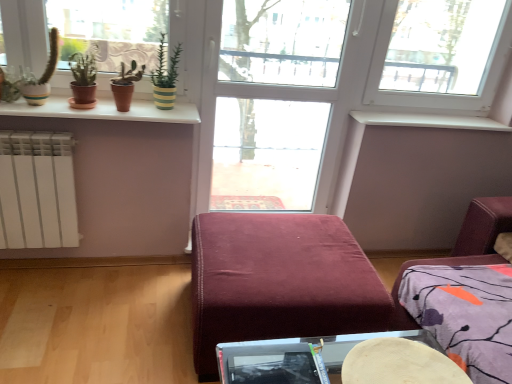
Question: Can you confirm if wooden round table at lower center is bigger than transparent glass door at center?

Choices:
 (A) no
 (B) yes

Answer: (A)

Question: Considering the relative sizes of wooden round table at lower center and transparent glass door at center in the image provided, is wooden round table at lower center thinner than transparent glass door at center?

Choices:
 (A) no
 (B) yes

Answer: (A)

Question: Is wooden round table at lower center positioned far away from transparent glass door at center?

Choices:
 (A) no
 (B) yes

Answer: (B)

Question: Would you say wooden round table at lower center is outside transparent glass door at center?

Choices:
 (A) yes
 (B) no

Answer: (A)

Question: Does wooden round table at lower center have a greater width compared to transparent glass door at center?

Choices:
 (A) no
 (B) yes

Answer: (B)

Question: Considering the relative sizes of wooden round table at lower center and transparent glass door at center in the image provided, is wooden round table at lower center smaller than transparent glass door at center?

Choices:
 (A) no
 (B) yes

Answer: (B)

Question: Is transparent glass door at center outside of wooden round table at lower center?

Choices:
 (A) no
 (B) yes

Answer: (B)

Question: Is transparent glass door at center oriented towards wooden round table at lower center?

Choices:
 (A) no
 (B) yes

Answer: (B)

Question: Is transparent glass door at center directly adjacent to wooden round table at lower center?

Choices:
 (A) no
 (B) yes

Answer: (A)

Question: Is transparent glass door at center oriented away from wooden round table at lower center?

Choices:
 (A) yes
 (B) no

Answer: (B)

Question: From the image's perspective, is transparent glass door at center below wooden round table at lower center?

Choices:
 (A) yes
 (B) no

Answer: (B)

Question: From the image's perspective, does transparent glass door at center appear higher than wooden round table at lower center?

Choices:
 (A) yes
 (B) no

Answer: (A)

Question: Is transparent glass door at center not near green striped pot at upper center?

Choices:
 (A) yes
 (B) no

Answer: (B)